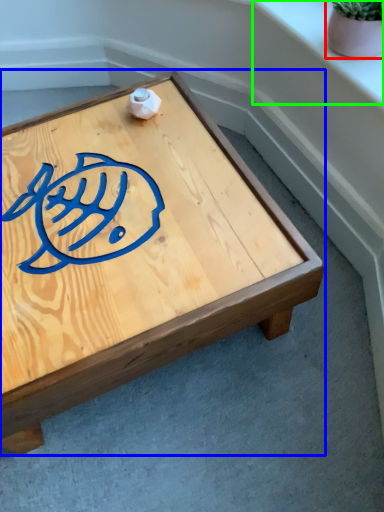
Question: Which object is positioned closest to flowerpot (highlighted by a red box)? Select from coffee table (highlighted by a blue box) and window sill (highlighted by a green box).

Choices:
 (A) coffee table
 (B) window sill

Answer: (B)